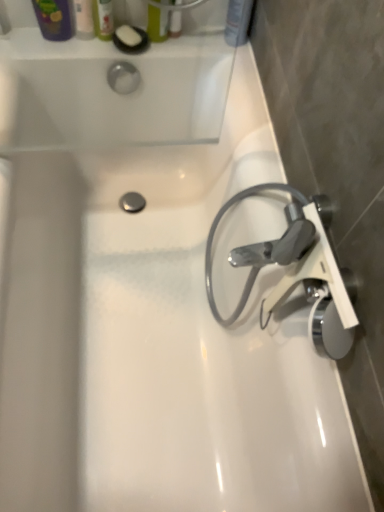
Question: In which direction should I rotate to look at matte green bottle at upper center, which is the 3th toiletry in left-to-right order?

Choices:
 (A) left
 (B) right

Answer: (A)

Question: Can you confirm if matte plastic shampoo bottle at upper right, which ranks as the 4th toiletry in left-to-right order, is positioned to the right of satin chrome faucet at right?

Choices:
 (A) yes
 (B) no

Answer: (B)

Question: From a real-world perspective, is matte plastic shampoo bottle at upper right, marked as the 1th toiletry in a right-to-left arrangement, over satin chrome faucet at right?

Choices:
 (A) yes
 (B) no

Answer: (A)

Question: Does matte plastic shampoo bottle at upper right, marked as the 1th toiletry in a right-to-left arrangement, have a greater width compared to satin chrome faucet at right?

Choices:
 (A) no
 (B) yes

Answer: (A)

Question: Considering the relative sizes of matte plastic shampoo bottle at upper right, marked as the 1th toiletry in a right-to-left arrangement, and satin chrome faucet at right in the image provided, is matte plastic shampoo bottle at upper right, marked as the 1th toiletry in a right-to-left arrangement, shorter than satin chrome faucet at right?

Choices:
 (A) yes
 (B) no

Answer: (A)

Question: From the image's perspective, is matte plastic shampoo bottle at upper right, marked as the 1th toiletry in a right-to-left arrangement, beneath satin chrome faucet at right?

Choices:
 (A) no
 (B) yes

Answer: (A)

Question: Is matte plastic shampoo bottle at upper right, marked as the 1th toiletry in a right-to-left arrangement, bigger than satin chrome faucet at right?

Choices:
 (A) no
 (B) yes

Answer: (A)

Question: Is matte green bottle at upper center, which is the 3th toiletry in left-to-right order, far away from matte plastic soap at upper left, arranged as the fourth toiletry when viewed from the right?

Choices:
 (A) yes
 (B) no

Answer: (B)

Question: Does matte green bottle at upper center, which is the 3th toiletry in left-to-right order, lie behind matte plastic soap at upper left, which is the 1th toiletry from left to right?

Choices:
 (A) no
 (B) yes

Answer: (A)

Question: From a real-world perspective, is matte green bottle at upper center, which is the 3th toiletry in left-to-right order, beneath matte plastic soap at upper left, which is the 1th toiletry from left to right?

Choices:
 (A) no
 (B) yes

Answer: (A)

Question: Is matte green bottle at upper center, the second toiletry in the right-to-left sequence, thinner than matte plastic soap at upper left, which is the 1th toiletry from left to right?

Choices:
 (A) yes
 (B) no

Answer: (B)

Question: Is matte green bottle at upper center, which is the 3th toiletry in left-to-right order, surrounding matte plastic soap at upper left, which is the 1th toiletry from left to right?

Choices:
 (A) no
 (B) yes

Answer: (A)

Question: Considering the relative sizes of matte green bottle at upper center, which is the 3th toiletry in left-to-right order, and matte plastic soap at upper left, arranged as the fourth toiletry when viewed from the right, in the image provided, is matte green bottle at upper center, which is the 3th toiletry in left-to-right order, taller than matte plastic soap at upper left, arranged as the fourth toiletry when viewed from the right,?

Choices:
 (A) no
 (B) yes

Answer: (B)

Question: Would you say matte plastic shampoo bottle at upper right, marked as the 1th toiletry in a right-to-left arrangement, is outside matte plastic soap at upper left, arranged as the fourth toiletry when viewed from the right?

Choices:
 (A) no
 (B) yes

Answer: (B)